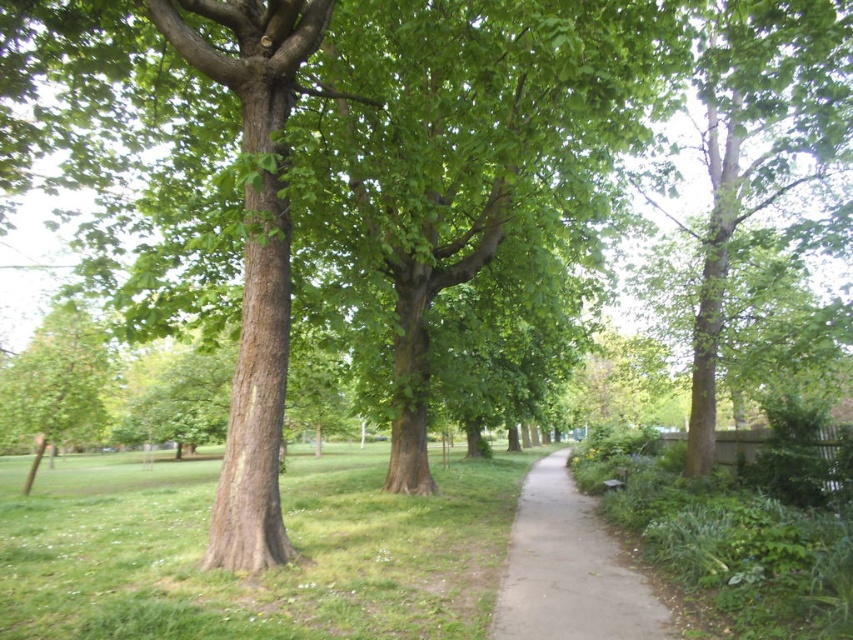
Is point (819, 122) positioned in front of point (59, 433)?

Yes, it is in front of point (59, 433).

Between point (795, 60) and point (27, 388), which one is positioned behind?

The point (27, 388) is more distant.

Locate an element on the screen. green leafy tree at right is located at coordinates point(758,144).

Which is below, green grass at center or green leafy tree at left?

green grass at center

Which is more to the left, green grass at center or green leafy tree at left?

Positioned to the left is green leafy tree at left.

Find the location of a particular element. The width and height of the screenshot is (853, 640). green grass at center is located at coordinates (260, 573).

Which is below, green leafy tree at right or gray concrete path at center?

gray concrete path at center is lower down.

Is point (746, 19) positioned before point (555, 460)?

Yes.

Does point (779, 109) come farther from viewer compared to point (496, 600)?

Yes, point (779, 109) is farther from viewer.

Where is `green leafy tree at right`? green leafy tree at right is located at coordinates (758, 144).